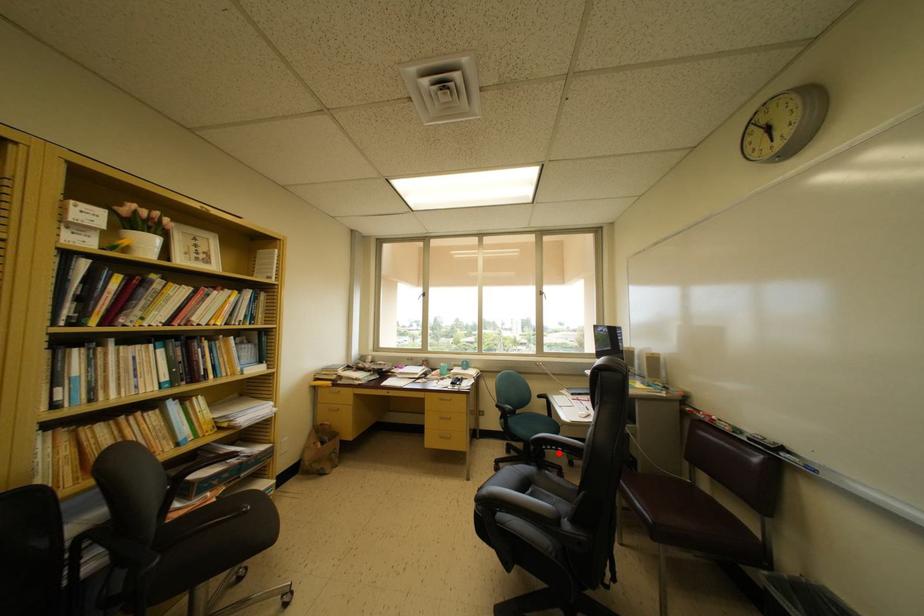
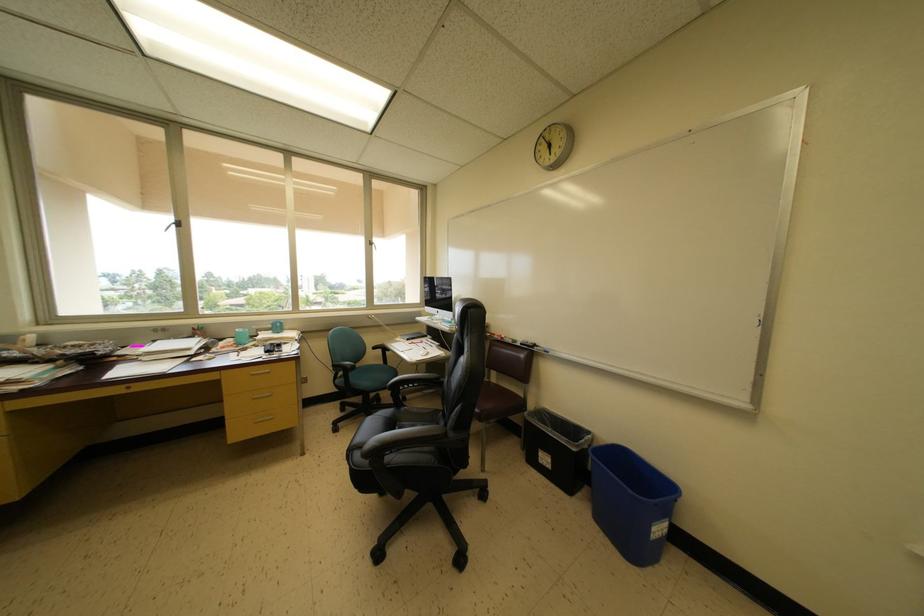
Question: A red point is marked in image1. In image2, is the corresponding 3D point closer to the camera or farther? Reply with the corresponding letter.

Choices:
 (A) The corresponding 3D point is closer.
 (B) The corresponding 3D point is farther.

Answer: (A)